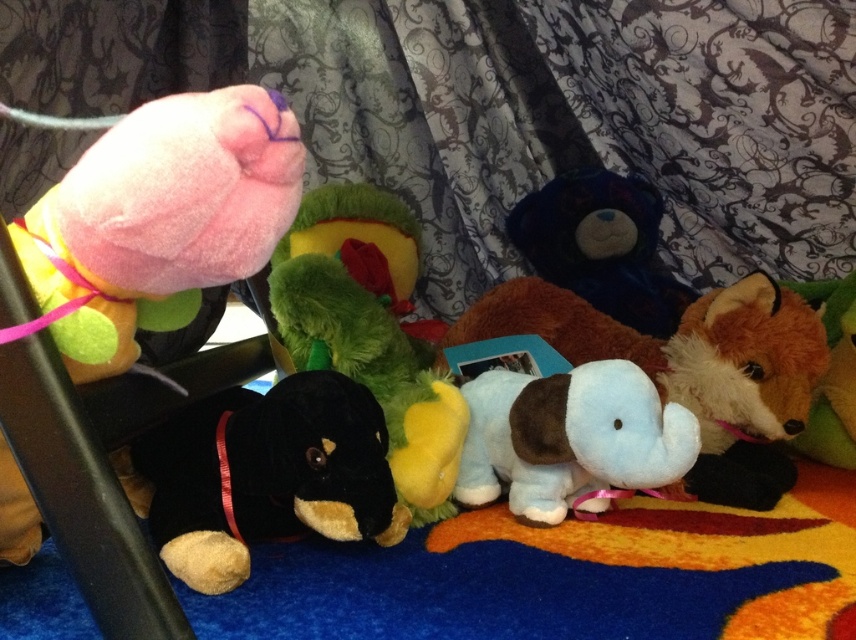
Question: Does light blue plush dog at center have a lesser width compared to velvety green plush at center?

Choices:
 (A) yes
 (B) no

Answer: (B)

Question: Estimate the real-world distances between objects in this image. Which object is farther from the blue plush elephant at center?

Choices:
 (A) light blue plush dog at center
 (B) pink plush toy at left
 (C) velvety green plush at center
 (D) black plush dog at lower left

Answer: (B)

Question: Estimate the real-world distances between objects in this image. Which object is farther from the blue plush elephant at center?

Choices:
 (A) black plush dog at lower left
 (B) light blue plush dog at center

Answer: (A)

Question: Estimate the real-world distances between objects in this image. Which object is closer to the blue plush elephant at center?

Choices:
 (A) pink plush toy at left
 (B) light blue plush dog at center
 (C) velvety green plush at center
 (D) black plush dog at lower left

Answer: (C)

Question: Does black plush dog at lower left lie behind blue plush elephant at center?

Choices:
 (A) no
 (B) yes

Answer: (A)

Question: Can you confirm if pink plush toy at left is smaller than black plush dog at lower left?

Choices:
 (A) yes
 (B) no

Answer: (B)